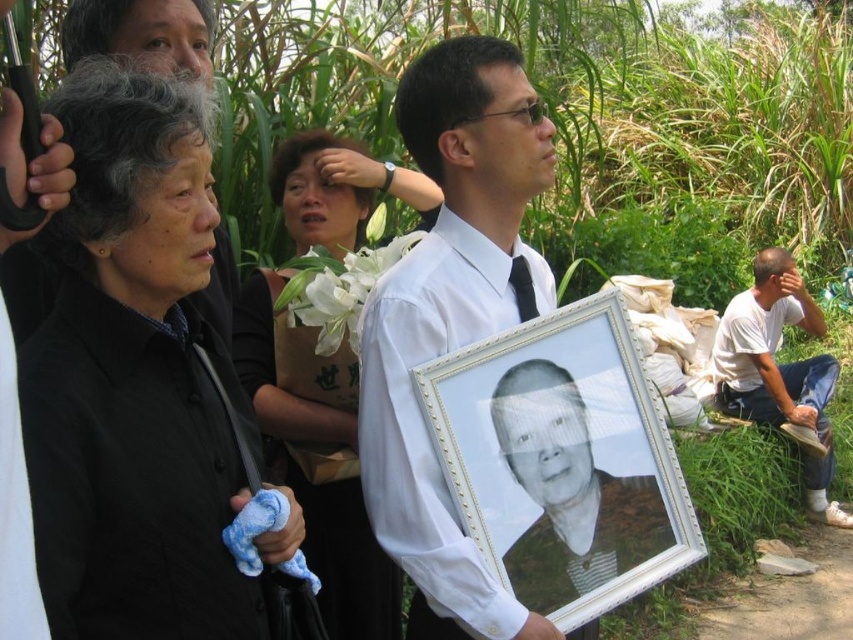
The height and width of the screenshot is (640, 853). Describe the element at coordinates (450, 317) in the screenshot. I see `white glossy photo frame at center` at that location.

Consider the image. Can you confirm if white glossy photo frame at center is bigger than matte black dress at center?

Actually, white glossy photo frame at center might be smaller than matte black dress at center.

Locate an element on the screen. The width and height of the screenshot is (853, 640). white glossy photo frame at center is located at coordinates (450, 317).

Where is `white glossy photo frame at center`? white glossy photo frame at center is located at coordinates (450, 317).

Does white glossy photo frame at center have a greater width compared to black satin tie at center?

Correct, the width of white glossy photo frame at center exceeds that of black satin tie at center.

Is white glossy photo frame at center positioned behind black satin tie at center?

No, white glossy photo frame at center is closer to the viewer.

Does point (469, 548) come in front of point (515, 257)?

Yes, it is.

The width and height of the screenshot is (853, 640). Find the location of `white glossy photo frame at center`. white glossy photo frame at center is located at coordinates (450, 317).

Between point (132, 131) and point (529, 528), which one is positioned in front?

Point (132, 131) is in front.

Is black matte jacket at upper left bigger than black glossy photo frame at center?

Yes, black matte jacket at upper left is bigger than black glossy photo frame at center.

Is point (181, 83) farther from viewer compared to point (611, 524)?

No, it is not.

The height and width of the screenshot is (640, 853). In order to click on black matte jacket at upper left in this screenshot , I will do `click(134, 380)`.